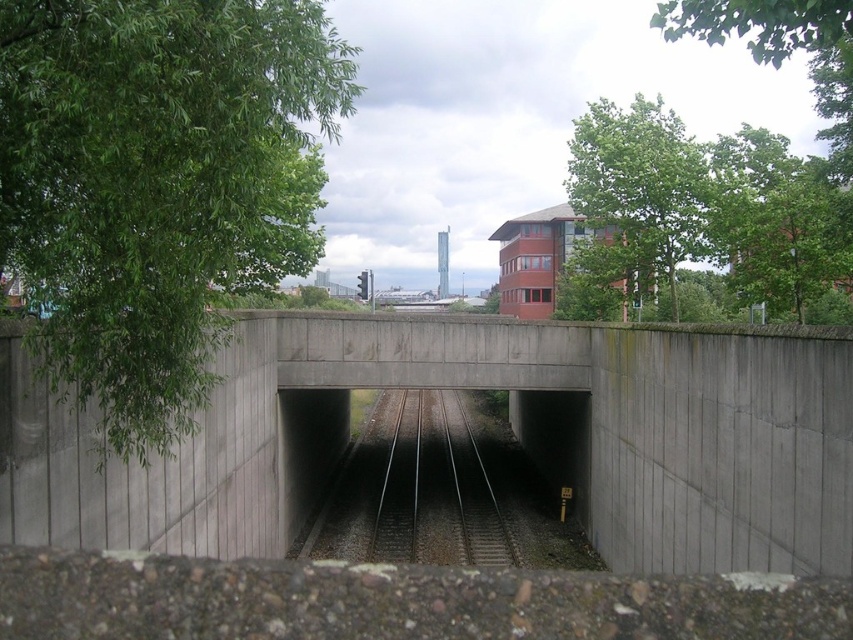
Is point (370, 323) positioned behind point (769, 29)?

Yes, it is.

Which is behind, point (706, 496) or point (762, 26)?

Point (706, 496)

At what (x,y) coordinates should I click in order to perform the action: click on concrete bridge at center. Please return your answer as a coordinate pair (x, y). The height and width of the screenshot is (640, 853). Looking at the image, I should click on (512, 426).

Can you confirm if green leafy tree at left is positioned to the right of green leafy tree at upper center?

In fact, green leafy tree at left is to the left of green leafy tree at upper center.

Looking at this image, is green leafy tree at left closer to the viewer compared to green leafy tree at upper center?

Yes, it is in front of green leafy tree at upper center.

At what (x,y) coordinates should I click in order to perform the action: click on green leafy tree at left. Please return your answer as a coordinate pair (x, y). This screenshot has height=640, width=853. Looking at the image, I should click on (157, 184).

Is concrete bridge at center taller than black metal train track at center?

Indeed, concrete bridge at center has a greater height compared to black metal train track at center.

Find the location of a particular element. This screenshot has height=640, width=853. concrete bridge at center is located at coordinates (512, 426).